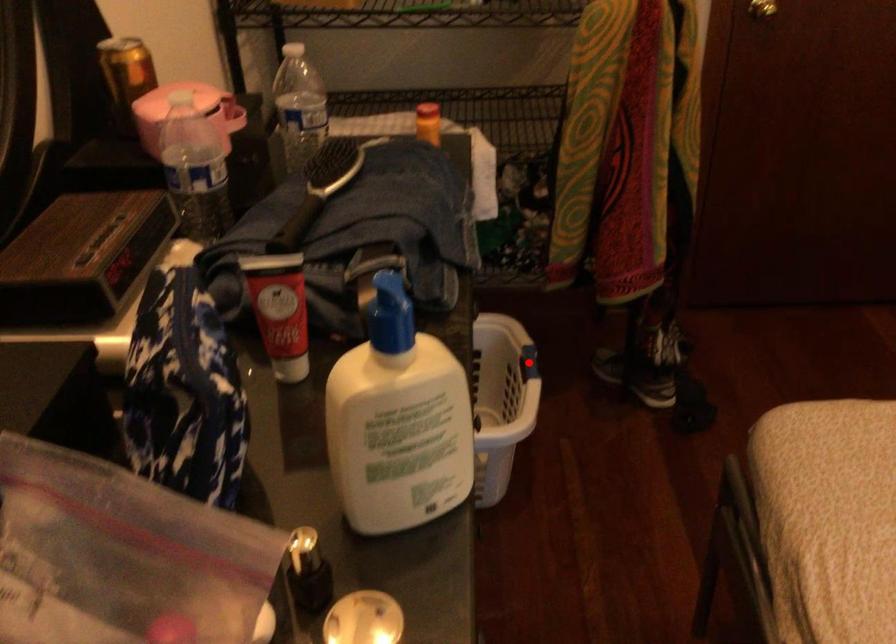
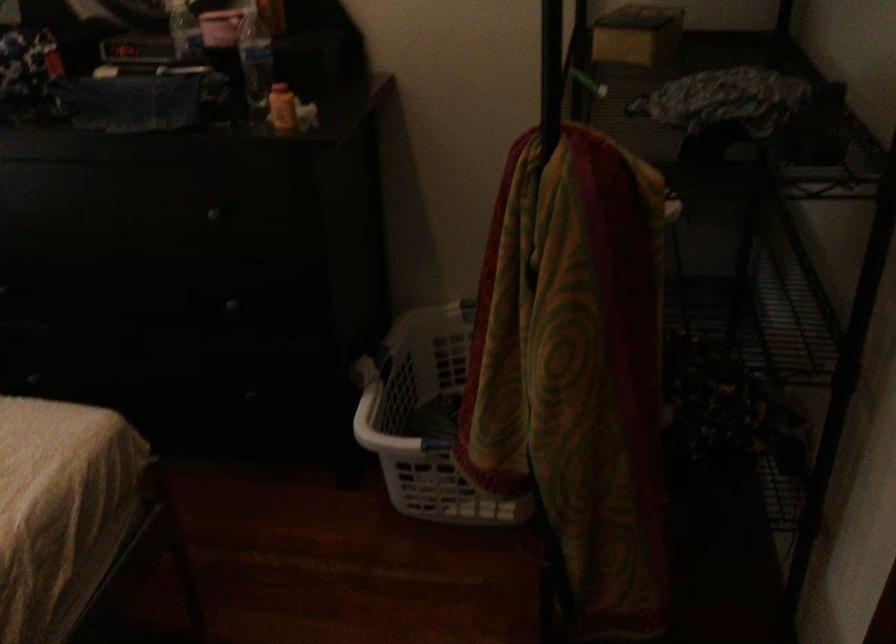
Question: I am providing you with two images of the same scene from different viewpoints. A red point is marked on the first image. Can you still see the location of the red point in image 2?

Choices:
 (A) Yes
 (B) No

Answer: (B)